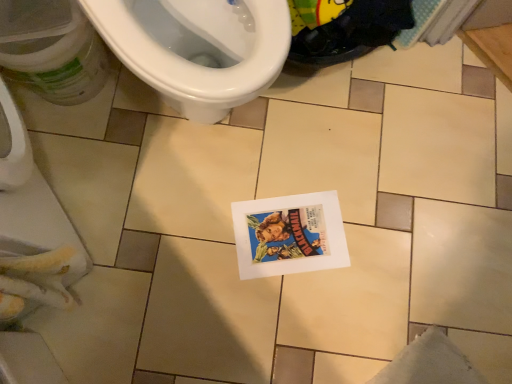
The width and height of the screenshot is (512, 384). Find the location of `free space to the back side of white paper comic book at center`. free space to the back side of white paper comic book at center is located at coordinates (302, 159).